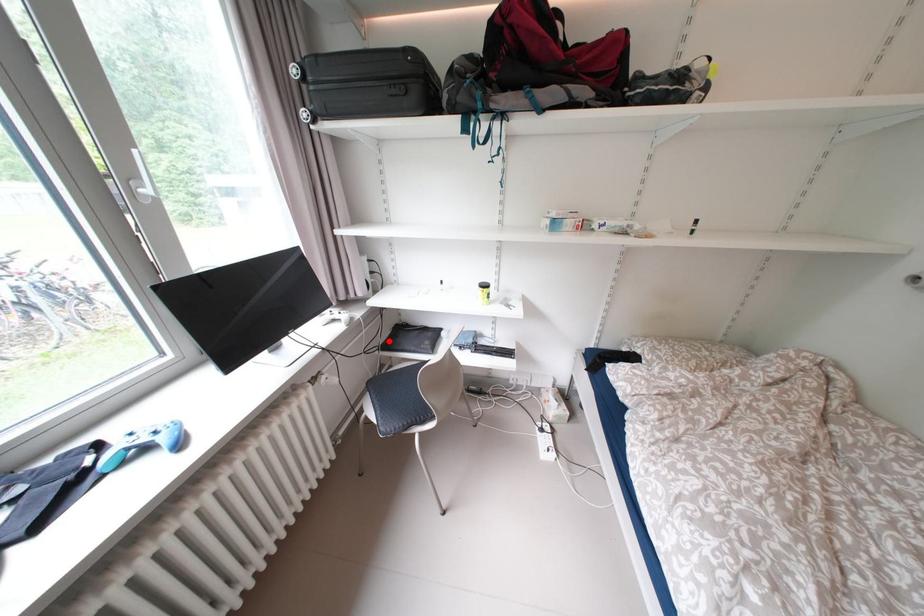
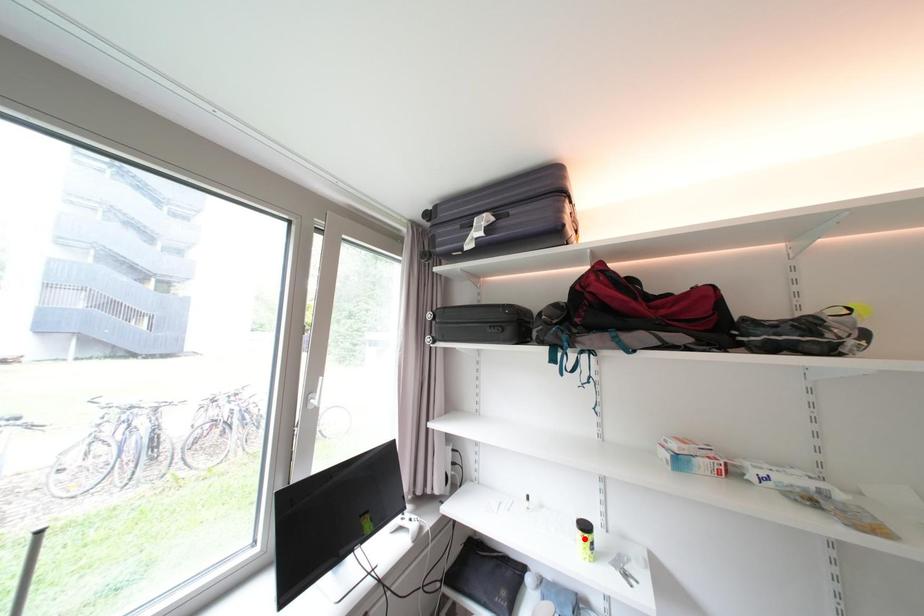
I am providing you with two images of the same scene from different viewpoints. A red point is marked on the first image and another point is marked on the second image. Does the point marked in image1 correspond to the same location as the one in image2?

No